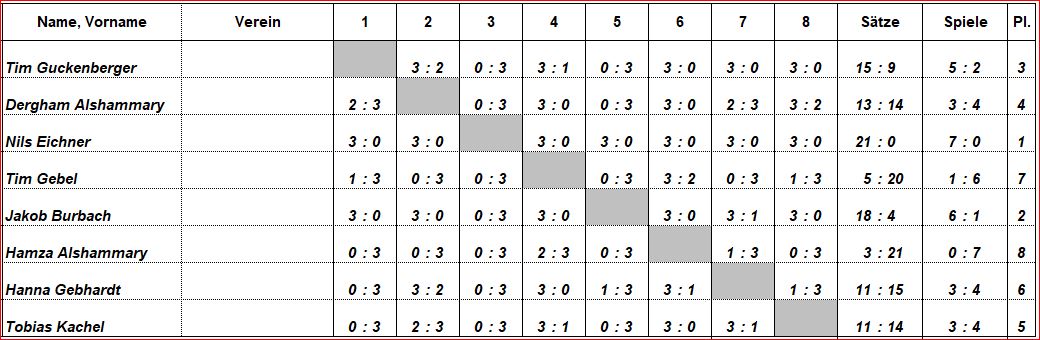
I want to click on table, so click(248, 182).